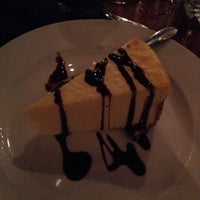
At what (x,y) coordinates should I click in order to perform the action: click on fork. Please return your answer as a coordinate pair (x, y). Looking at the image, I should click on (123, 20).